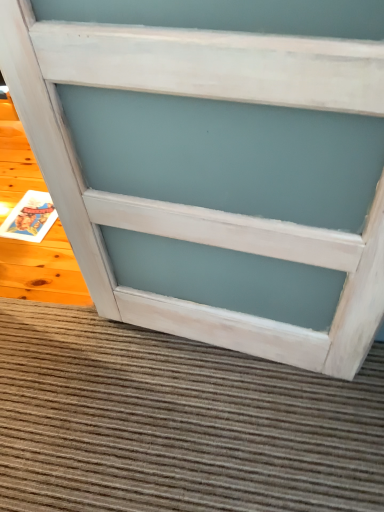
Identify the location of blank space situated above white painted wood cabinet at lower center (from a real-world perspective). The width and height of the screenshot is (384, 512). (215, 79).